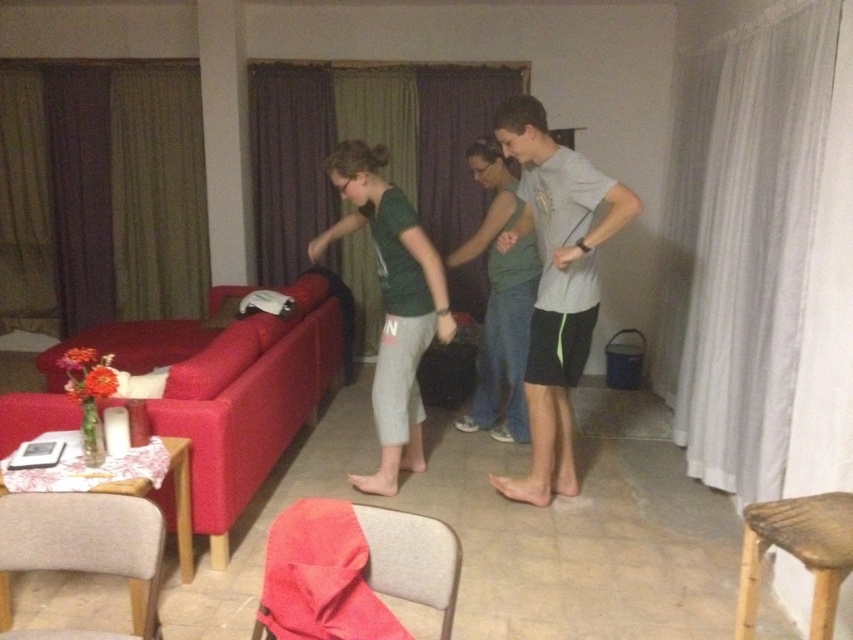
You are organizing a small gathering in the living room and need to place a decorative tray on the available space between the green matte shirt at center and the bamboo stool at lower right. Based on their sizes, do you think there is enough space to place the tray?

The green matte shirt at center might be wider than bamboo stool at lower right, so the space between them may not be sufficient to accommodate the tray comfortably. Consider checking the exact dimensions before placing the tray.